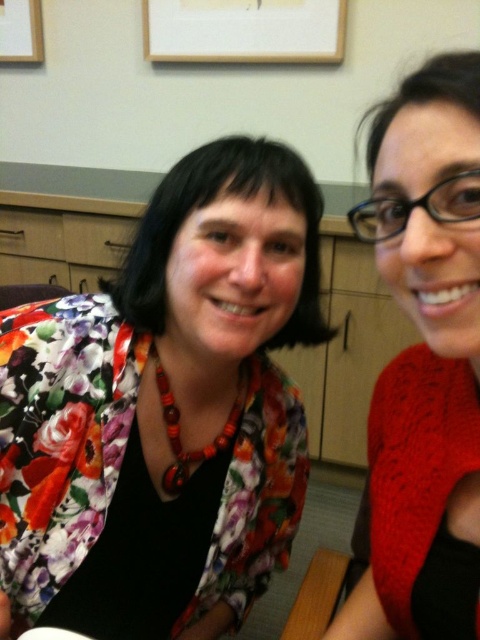
Question: Which point is farther from the camera taking this photo?

Choices:
 (A) (264, 33)
 (B) (41, 28)

Answer: (B)

Question: Can you confirm if floral fabric jacket at center is positioned below knitted red sweater at right?

Choices:
 (A) yes
 (B) no

Answer: (A)

Question: Which of the following is the closest to the observer?

Choices:
 (A) wooden picture frame at upper left
 (B) white matte picture frame at upper center

Answer: (B)

Question: Which point is farther to the camera?

Choices:
 (A) (408, 404)
 (B) (240, 304)

Answer: (A)

Question: Does knitted red sweater at right have a larger size compared to wooden picture frame at upper left?

Choices:
 (A) yes
 (B) no

Answer: (A)

Question: Is knitted red sweater at right below white matte picture frame at upper center?

Choices:
 (A) yes
 (B) no

Answer: (A)